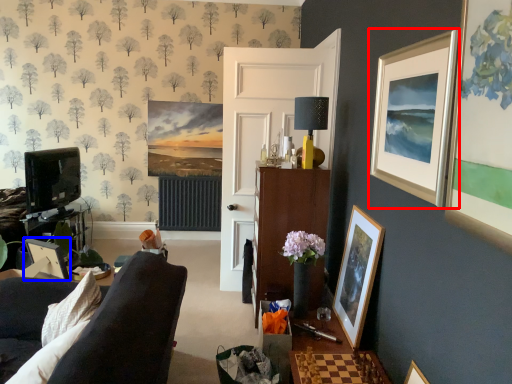
Question: Which of the following is the farthest to the observer, picture frame (highlighted by a red box) or picture frame (highlighted by a blue box)?

Choices:
 (A) picture frame
 (B) picture frame

Answer: (B)